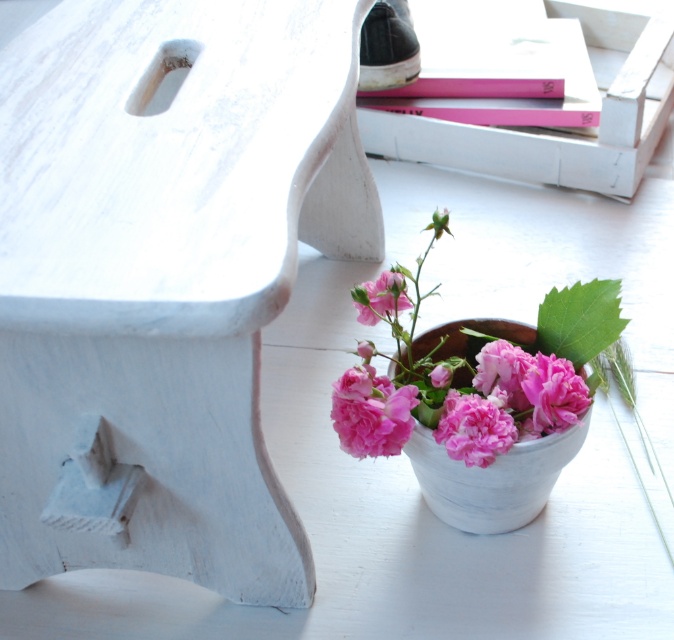
You are arranging items on a table and need to place the pink matte flower at lower center and the suede black shoe at upper center such that they are exactly 27.17 inches apart. Given that the table is 36 inches wide, can both items fit on the table without overlapping?

The pink matte flower at lower center and suede black shoe at upper center are 27.17 inches apart. Since the table is 36 inches wide, which is wider than the distance between them, both items can fit on the table without overlapping as long as they are placed within the table boundaries.

You are arranging items on a table and need to place the pink matte flower at lower center and the suede black shoe at upper center. Based on their positions, which item is closer to the edge of the table?

The suede black shoe at upper center is closer to the edge of the table because it is positioned above the pink matte flower at lower center, which places it nearer to the upper edge.